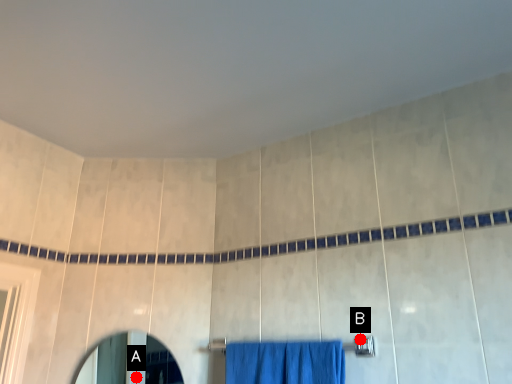
Question: Two points are circled on the image, labeled by A and B beside each circle. Which point appears closest to the camera in this image?

Choices:
 (A) A is closer
 (B) B is closer

Answer: (B)